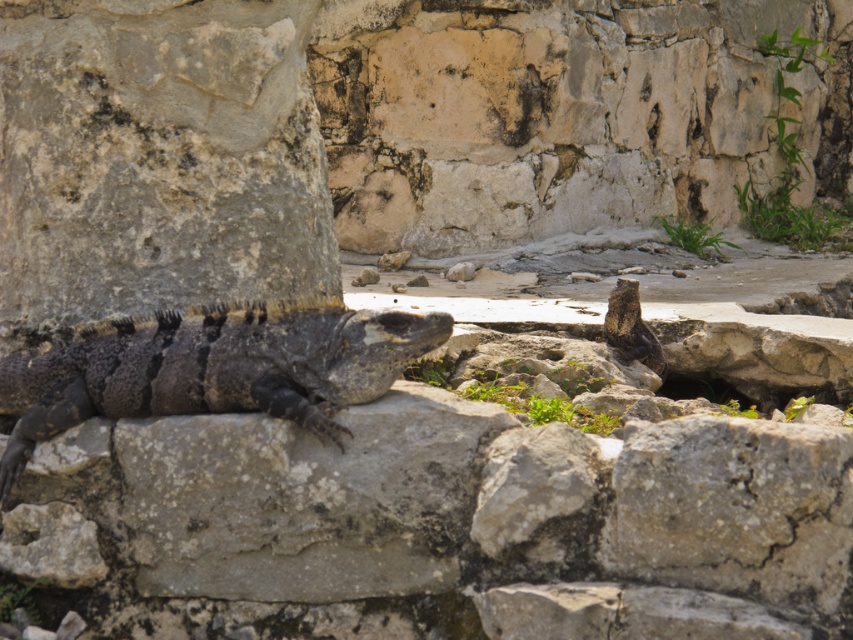
Question: Which point is closer to the camera?

Choices:
 (A) dark brown scaly lizard at center
 (B) dark gray scaly lizard at center

Answer: (B)

Question: Among these objects, which one is nearest to the camera?

Choices:
 (A) dark gray scaly lizard at center
 (B) dark brown scaly lizard at center

Answer: (A)

Question: Is dark gray scaly lizard at center bigger than dark brown scaly lizard at center?

Choices:
 (A) no
 (B) yes

Answer: (B)

Question: Does dark gray scaly lizard at center have a lesser width compared to dark brown scaly lizard at center?

Choices:
 (A) no
 (B) yes

Answer: (A)

Question: Does dark gray scaly lizard at center lie in front of dark brown scaly lizard at center?

Choices:
 (A) no
 (B) yes

Answer: (B)